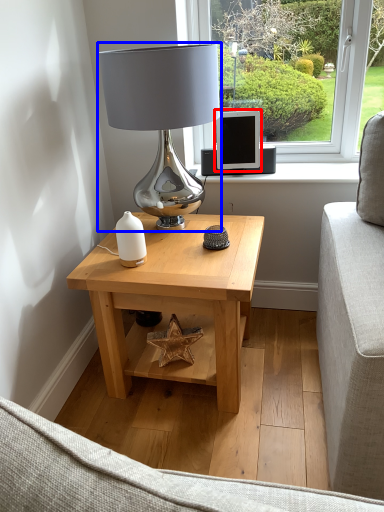
Question: Which object appears closest to the camera in this image, computer monitor (highlighted by a red box) or table lamp (highlighted by a blue box)?

Choices:
 (A) computer monitor
 (B) table lamp

Answer: (B)